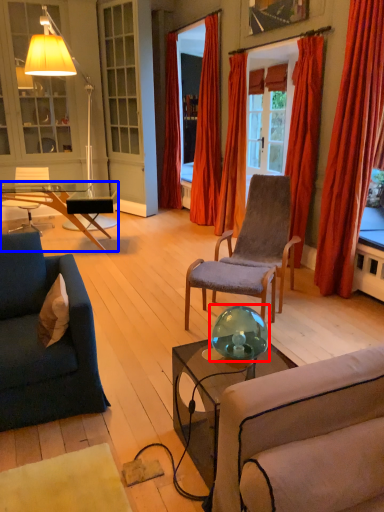
Question: Which of the following is the farthest to the observer, teal (highlighted by a red box) or coffee table (highlighted by a blue box)?

Choices:
 (A) teal
 (B) coffee table

Answer: (B)